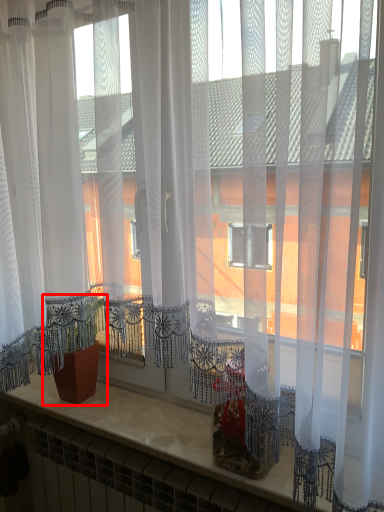
Question: From the image, what is the correct spatial relationship of houseplant (annotated by the red box) in relation to counter top?

Choices:
 (A) left
 (B) right

Answer: (A)